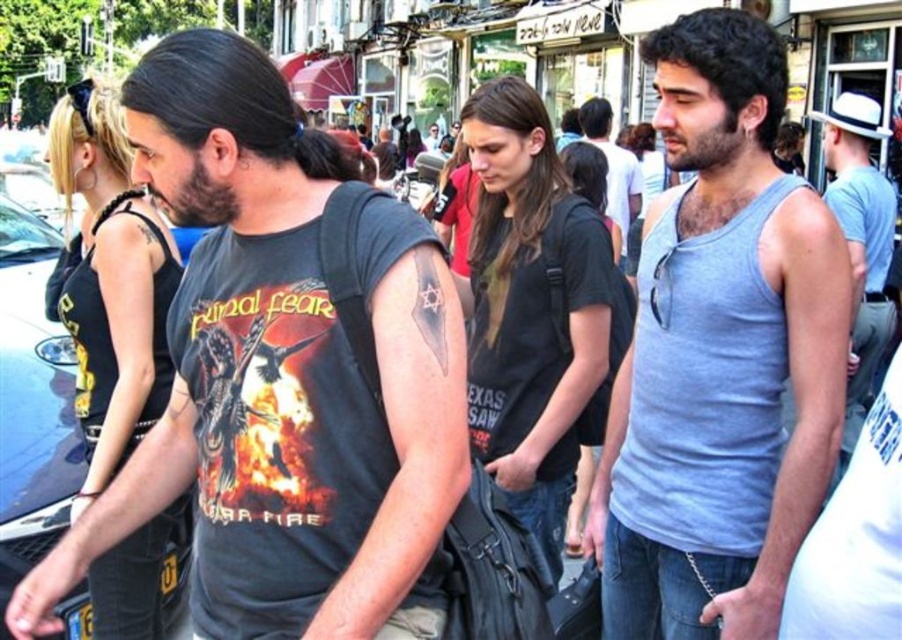
How distant is metallic blue car at left from gray tank top at center?

metallic blue car at left is 35.96 meters from gray tank top at center.

Between point (10, 362) and point (611, 177), which one is positioned in front?

Point (10, 362)

The image size is (902, 640). In order to click on metallic blue car at left in this screenshot , I will do `click(31, 404)`.

Locate an element on the screen. metallic blue car at left is located at coordinates (31, 404).

In the scene shown: Is gray cotton tank top at center above gray cotton tank top at right?

No, gray cotton tank top at center is not above gray cotton tank top at right.

Is point (725, 611) positioned in front of point (852, 307)?

Yes, it is.

Where is `gray cotton tank top at center`? The image size is (902, 640). gray cotton tank top at center is located at coordinates (720, 355).

Does dark gray t-shirt at left have a smaller size compared to gray cotton tank top at right?

Indeed, dark gray t-shirt at left has a smaller size compared to gray cotton tank top at right.

Is dark gray t-shirt at left shorter than gray cotton tank top at right?

In fact, dark gray t-shirt at left may be taller than gray cotton tank top at right.

The image size is (902, 640). What do you see at coordinates (281, 376) in the screenshot?
I see `dark gray t-shirt at left` at bounding box center [281, 376].

At what (x,y) coordinates should I click in order to perform the action: click on dark gray t-shirt at left. Please return your answer as a coordinate pair (x, y). This screenshot has width=902, height=640. Looking at the image, I should click on click(x=281, y=376).